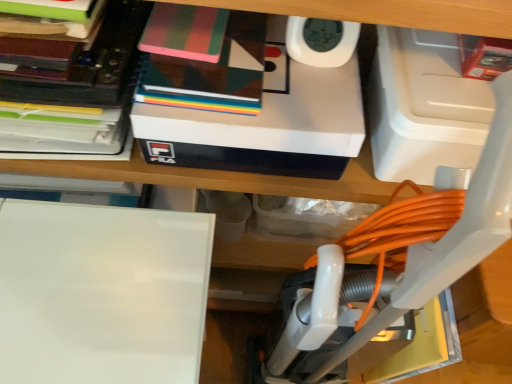
Locate an element on the screen. The width and height of the screenshot is (512, 384). white matte box at upper center is located at coordinates (251, 107).

This screenshot has height=384, width=512. What do you see at coordinates (101, 293) in the screenshot?
I see `white glossy board at lower left` at bounding box center [101, 293].

The image size is (512, 384). What do you see at coordinates (77, 98) in the screenshot?
I see `matte black book at upper left, which ranks as the first book in left-to-right order` at bounding box center [77, 98].

Identify the location of multicolored paper at upper center. (185, 32).

Is white matte box at upper center completely or partially inside white glossy board at lower left?

No.

In terms of width, does white glossy board at lower left look wider or thinner when compared to white matte box at upper center?

white glossy board at lower left is wider than white matte box at upper center.

Which is less distant, (91, 309) or (215, 134)?

The point (215, 134) is closer.

Relative to white matte box at upper center, is white glossy board at lower left in front or behind?

In the image, white glossy board at lower left appears in front of white matte box at upper center.

From the image's perspective, is white glossy board at lower left above or below matte black book at upper left, which ranks as the first book in left-to-right order?

From the image's perspective, white glossy board at lower left appears below matte black book at upper left, which ranks as the first book in left-to-right order.

Who is taller, white glossy board at lower left or matte black book at upper left, which ranks as the first book in left-to-right order?

With more height is white glossy board at lower left.

Considering the relative positions of white glossy board at lower left and matte black book at upper left, which is the second book in right-to-left order, in the image provided, is white glossy board at lower left to the left of matte black book at upper left, which is the second book in right-to-left order, from the viewer's perspective?

Correct, you'll find white glossy board at lower left to the left of matte black book at upper left, which is the second book in right-to-left order.

Which book is the 1st one when counting from the right side of the white glossy board at lower left? Please provide its 2D coordinates.

[(77, 98)]

Does geometric-patterned notebook at upper center, the first book from the right, come in front of matte black book at upper left, which ranks as the first book in left-to-right order?

That is False.

Identify the location of book behind the matte black book at upper left, which ranks as the first book in left-to-right order. This screenshot has height=384, width=512. (212, 72).

From the image's perspective, between geometric-patterned notebook at upper center, the first book from the right, and matte black book at upper left, which ranks as the first book in left-to-right order, which one is located above?

matte black book at upper left, which ranks as the first book in left-to-right order, appears higher in the image.

Is geometric-patterned notebook at upper center, which is the 2th book in left-to-right order, at the left side of matte black book at upper left, which ranks as the first book in left-to-right order?

Incorrect, geometric-patterned notebook at upper center, which is the 2th book in left-to-right order, is not on the left side of matte black book at upper left, which ranks as the first book in left-to-right order.

From the picture: Is white plastic vacuum at center next to white matte box at upper center?

No.

Considering the points (479, 246) and (269, 162), which point is behind, point (479, 246) or point (269, 162)?

The point (269, 162) is behind.

Is white plastic vacuum at center positioned with its back to white matte box at upper center?

That's right, white plastic vacuum at center is facing away from white matte box at upper center.

Consider the image. Can you confirm if white plastic vacuum at center is shorter than multicolored paper at upper center?

Incorrect, the height of white plastic vacuum at center does not fall short of that of multicolored paper at upper center.

Considering the positions of objects white plastic vacuum at center and multicolored paper at upper center in the image provided, who is more to the right, white plastic vacuum at center or multicolored paper at upper center?

Positioned to the right is white plastic vacuum at center.

Is point (384, 255) closer or farther from the camera than point (149, 52)?

Point (384, 255).

Can you confirm if white glossy board at lower left is positioned to the left of geometric-patterned notebook at upper center, the first book from the right?

Correct, you'll find white glossy board at lower left to the left of geometric-patterned notebook at upper center, the first book from the right.

Is point (19, 351) closer to camera compared to point (261, 49)?

Yes.

Considering the relative sizes of white glossy board at lower left and geometric-patterned notebook at upper center, the first book from the right, in the image provided, is white glossy board at lower left taller than geometric-patterned notebook at upper center, the first book from the right,?

Indeed, white glossy board at lower left has a greater height compared to geometric-patterned notebook at upper center, the first book from the right.

Is white glossy board at lower left smaller than geometric-patterned notebook at upper center, which is the 2th book in left-to-right order?

Incorrect, white glossy board at lower left is not smaller in size than geometric-patterned notebook at upper center, which is the 2th book in left-to-right order.

Consider the image. From a real-world perspective, is white glossy board at lower left over multicolored paper at upper center?

No, from a real-world perspective, white glossy board at lower left is not above multicolored paper at upper center.

Between white glossy board at lower left and multicolored paper at upper center, which one has less height?

multicolored paper at upper center is shorter.

Is white glossy board at lower left bigger than multicolored paper at upper center?

Yes, white glossy board at lower left is bigger than multicolored paper at upper center.

Image resolution: width=512 pixels, height=384 pixels. Identify the location of box above the white glossy board at lower left (from a real-world perspective). (251, 107).

This screenshot has height=384, width=512. Identify the location of wide below the matte black book at upper left, which ranks as the first book in left-to-right order (from the image's perspective). (101, 293).

When comparing their distances from white matte box at upper center, does geometric-patterned notebook at upper center, the first book from the right, or white plastic vacuum at center seem further?

white plastic vacuum at center is positioned further to the anchor white matte box at upper center.

Estimate the real-world distances between objects in this image. Which object is closer to multicolored paper at upper center, geometric-patterned notebook at upper center, the first book from the right, or white matte box at upper center?

Based on the image, geometric-patterned notebook at upper center, the first book from the right, appears to be nearer to multicolored paper at upper center.

Which object lies further to the anchor point white plastic vacuum at center, geometric-patterned notebook at upper center, the first book from the right, or matte black book at upper left, which ranks as the first book in left-to-right order?

matte black book at upper left, which ranks as the first book in left-to-right order, is positioned further to the anchor white plastic vacuum at center.

Looking at the image, which one is located closer to white plastic vacuum at center, white matte box at upper center or white glossy board at lower left?

white matte box at upper center is positioned closer to the anchor white plastic vacuum at center.

From the image, which object appears to be nearer to matte black book at upper left, which ranks as the first book in left-to-right order, white glossy board at lower left or geometric-patterned notebook at upper center, which is the 2th book in left-to-right order?

geometric-patterned notebook at upper center, which is the 2th book in left-to-right order, lies closer to matte black book at upper left, which ranks as the first book in left-to-right order, than the other object.

From the image, which object appears to be nearer to matte black book at upper left, which ranks as the first book in left-to-right order, geometric-patterned notebook at upper center, the first book from the right, or multicolored paper at upper center?

geometric-patterned notebook at upper center, the first book from the right, is closer to matte black book at upper left, which ranks as the first book in left-to-right order.

Considering their positions, is multicolored paper at upper center positioned closer to white plastic vacuum at center than matte black book at upper left, which is the second book in right-to-left order?

matte black book at upper left, which is the second book in right-to-left order, is positioned closer to the anchor white plastic vacuum at center.

From the picture: Estimate the real-world distances between objects in this image. Which object is closer to matte black book at upper left, which is the second book in right-to-left order, white glossy board at lower left or multicolored paper at upper center?

multicolored paper at upper center.

I want to click on box between matte black book at upper left, which is the second book in right-to-left order, and white glossy board at lower left from top to bottom, so click(x=251, y=107).

You are a GUI agent. You are given a task and a screenshot of the screen. Output one action in this format:
    pyautogui.click(x=<x>, y=<y>)
    Task: Click on the paperback book situated between matte black book at upper left, which is the second book in right-to-left order, and geometric-patterned notebook at upper center, the first book from the right, from left to right
    Image resolution: width=512 pixels, height=384 pixels.
    Given the screenshot: What is the action you would take?
    pyautogui.click(x=185, y=32)

I want to click on book between matte black book at upper left, which ranks as the first book in left-to-right order, and white matte box at upper center, so click(212, 72).

Locate an element on the screen. This screenshot has height=384, width=512. vacuum that lies between geometric-patterned notebook at upper center, the first book from the right, and white glossy board at lower left from top to bottom is located at coordinates (395, 264).